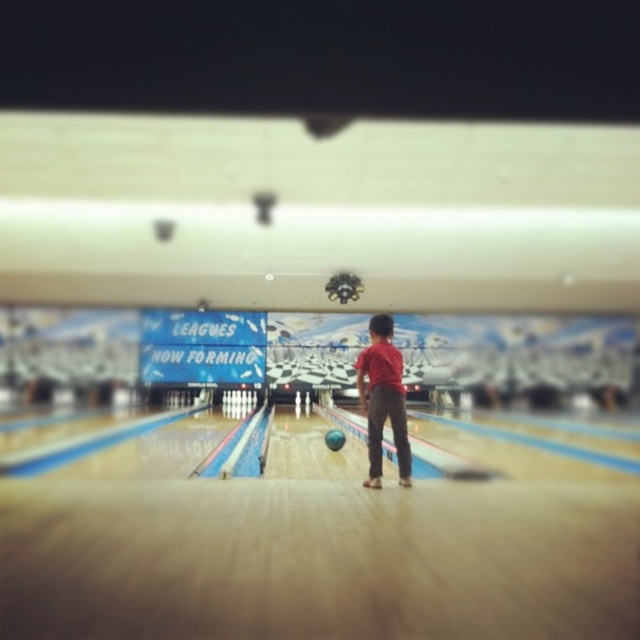
Question: Which point is closer to the camera?

Choices:
 (A) red matte shirt at center
 (B) shiny blue bowling ball at center

Answer: (A)

Question: Considering the relative positions of red matte shirt at center and shiny blue bowling ball at center in the image provided, where is red matte shirt at center located with respect to shiny blue bowling ball at center?

Choices:
 (A) left
 (B) right

Answer: (B)

Question: Is red matte shirt at center to the left of shiny blue bowling ball at center from the viewer's perspective?

Choices:
 (A) yes
 (B) no

Answer: (B)

Question: Which point is closer to the camera?

Choices:
 (A) red matte shirt at center
 (B) shiny blue bowling ball at center

Answer: (A)

Question: In this image, where is red matte shirt at center located relative to shiny blue bowling ball at center?

Choices:
 (A) above
 (B) below

Answer: (A)